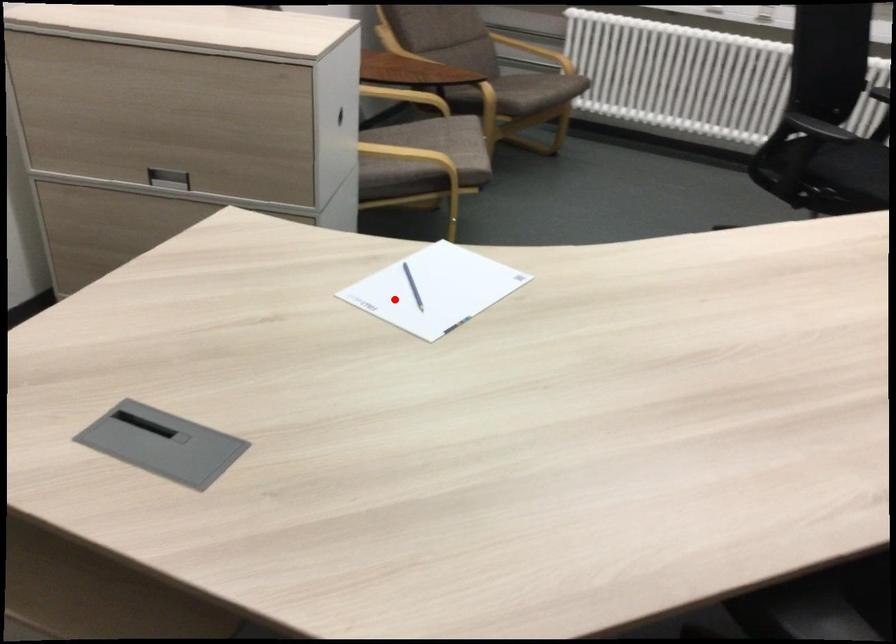
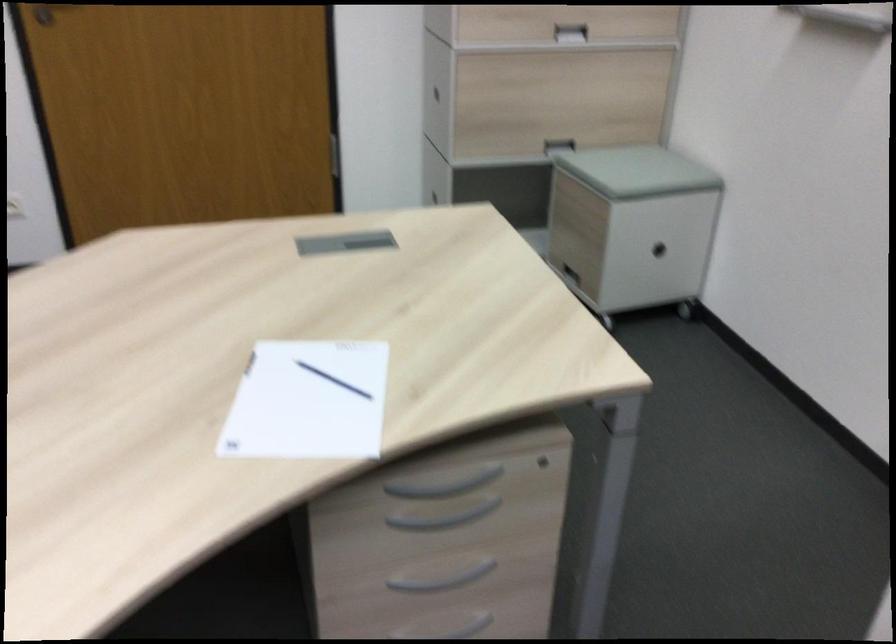
Question: I am providing you with two images of the same scene from different viewpoints. In image1, a red point is highlighted. Considering the same 3D point in image2, which of the following is correct?

Choices:
 (A) It is closer
 (B) It is farther

Answer: (A)